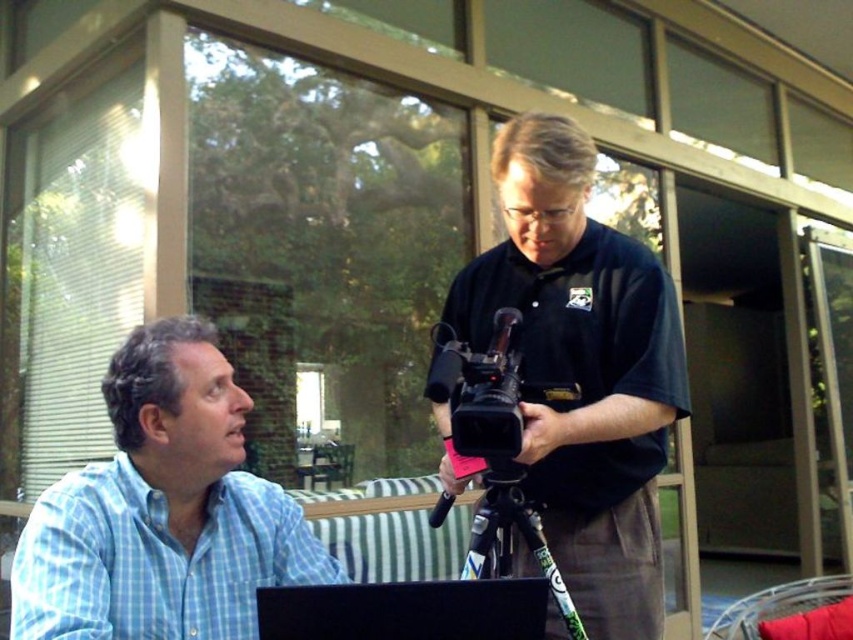
Question: Does blue checkered shirt at left have a greater width compared to black matte laptop at lower center?

Choices:
 (A) yes
 (B) no

Answer: (A)

Question: Can you confirm if black matte camera at center is positioned to the right of black matte laptop at lower center?

Choices:
 (A) no
 (B) yes

Answer: (B)

Question: Can you confirm if blue checkered shirt at left is positioned below black matte laptop at lower center?

Choices:
 (A) no
 (B) yes

Answer: (A)

Question: Which point appears closest to the camera in this image?

Choices:
 (A) click(x=572, y=268)
 (B) click(x=19, y=595)

Answer: (B)

Question: Which point is closer to the camera taking this photo?

Choices:
 (A) (403, 586)
 (B) (463, 294)
 (C) (132, 364)

Answer: (A)

Question: Which of the following is the farthest from the observer?

Choices:
 (A) blue checkered shirt at left
 (B) black matte camera at center

Answer: (B)